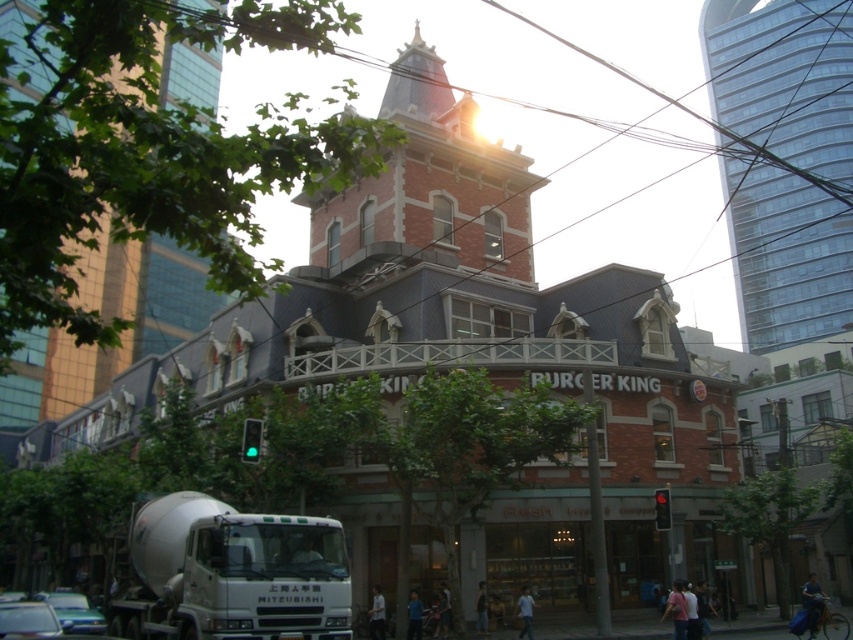
Does light brown leather jacket at lower center appear over blue fabric shirt at lower center?

No, light brown leather jacket at lower center is not above blue fabric shirt at lower center.

Who is positioned more to the left, light brown leather jacket at lower center or blue fabric shirt at lower center?

blue fabric shirt at lower center is more to the left.

Is point (527, 588) closer to viewer compared to point (416, 621)?

No, it is behind (416, 621).

Where is `light brown leather jacket at lower center`? The image size is (853, 640). light brown leather jacket at lower center is located at coordinates (525, 612).

Measure the distance between transparent glass tower at upper right and camera.

A distance of 182.64 meters exists between transparent glass tower at upper right and camera.

Is point (846, 29) farther from viewer compared to point (370, 625)?

Yes.

Does point (795, 196) lie behind point (380, 614)?

Yes, point (795, 196) is farther from viewer.

Where is `transparent glass tower at upper right`? This screenshot has height=640, width=853. transparent glass tower at upper right is located at coordinates (782, 77).

Is white matte shirt at lower center to the right of blue fabric shirt at lower center from the viewer's perspective?

No, white matte shirt at lower center is not to the right of blue fabric shirt at lower center.

Who is more distant from viewer, (381,595) or (413,627)?

The point (381,595) is behind.

Find the location of a particular element. The width and height of the screenshot is (853, 640). white matte shirt at lower center is located at coordinates (376, 614).

The image size is (853, 640). What are the coordinates of `white matte shirt at lower center` in the screenshot? It's located at (376, 614).